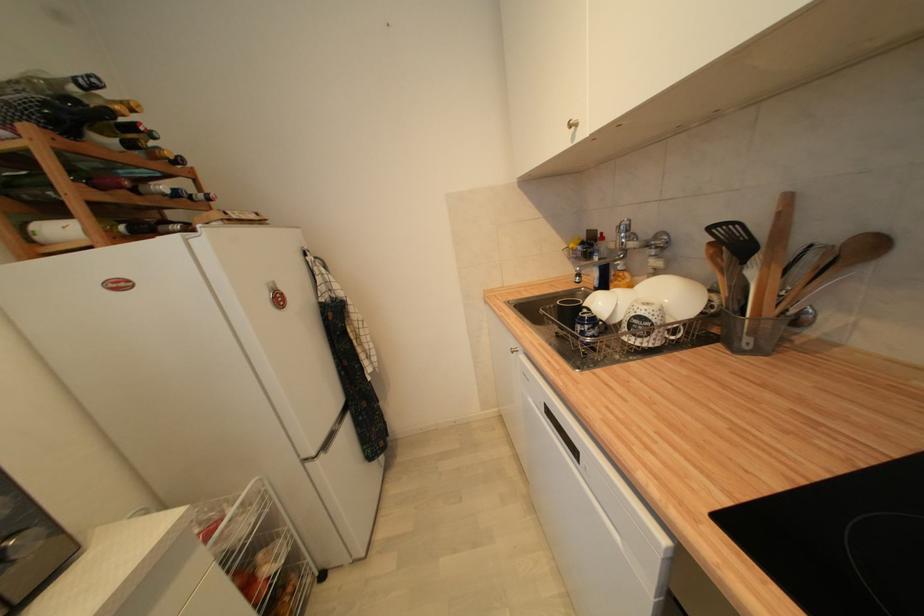
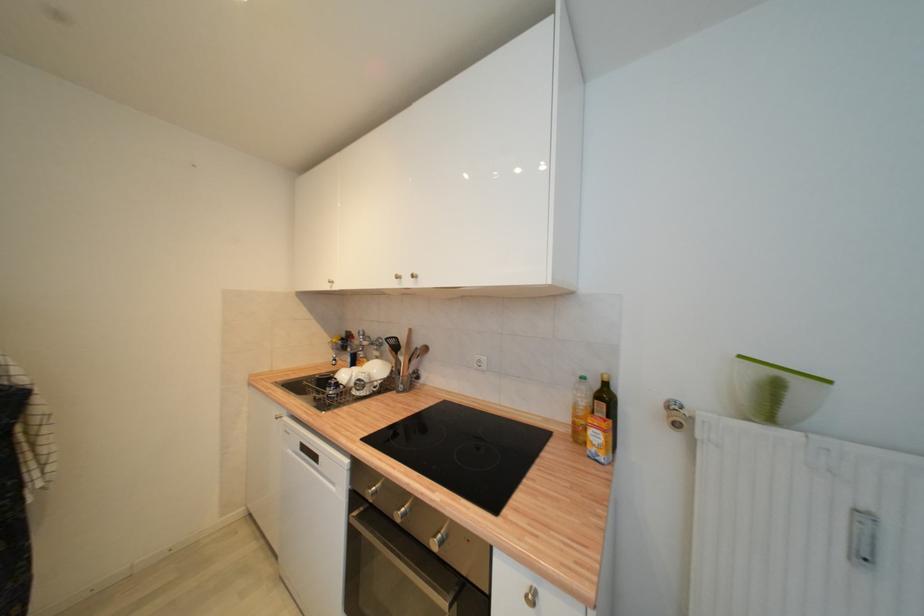
Find the pixel in the second image that matches point (645, 320) in the first image.

(363, 382)